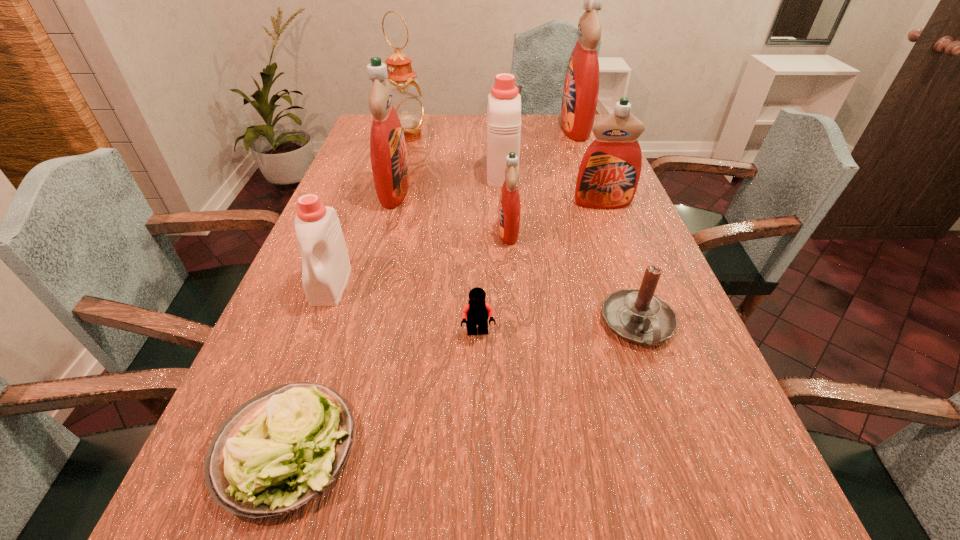
At what (x,y) coordinates should I click in order to perform the action: click on free space at the far edge. Please return your answer as a coordinate pair (x, y). This screenshot has height=540, width=960. Looking at the image, I should click on (534, 126).

This screenshot has height=540, width=960. In the image, there is a desktop. Find the location of `blank space at the left edge`. blank space at the left edge is located at coordinates pyautogui.click(x=300, y=287).

Locate an element on the screen. This screenshot has width=960, height=540. vacant space at the right edge is located at coordinates (672, 435).

The image size is (960, 540). I want to click on vacant space in between the right white detergent and the candle, so click(570, 248).

Image resolution: width=960 pixels, height=540 pixels. I want to click on free space between the right white detergent and the candle, so coord(570,248).

Locate an element on the screen. The height and width of the screenshot is (540, 960). vacant space that's between the shortest object and the third shortest object is located at coordinates (463, 387).

Where is `free space between the green lettuce and the second nearest detergent`? The width and height of the screenshot is (960, 540). free space between the green lettuce and the second nearest detergent is located at coordinates (397, 340).

At what (x,y) coordinates should I click in order to perform the action: click on free space between the Lego and the candle. Please return your answer as a coordinate pair (x, y). Looking at the image, I should click on (558, 328).

I want to click on unoccupied position between the black Lego and the eighth tallest object, so 558,328.

This screenshot has height=540, width=960. I want to click on unoccupied position between the right white detergent and the black Lego, so click(x=490, y=252).